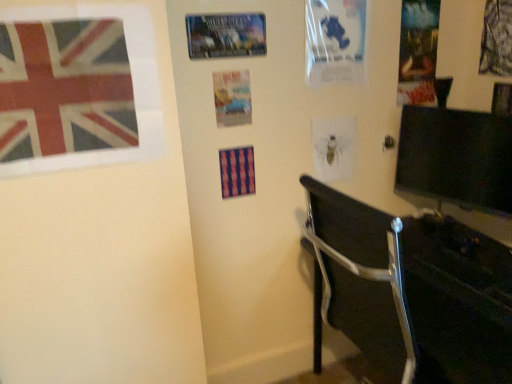
At what (x,y) coordinates should I click in order to perform the action: click on matte paper poster at upper right, marked as the second poster page in a right-to-left arrangement. Please return your answer as a coordinate pair (x, y). The width and height of the screenshot is (512, 384). Looking at the image, I should click on [x=418, y=52].

Describe the element at coordinates (65, 89) in the screenshot. I see `printed fabric flag at upper left` at that location.

Locate an element on the screen. The height and width of the screenshot is (384, 512). metallic silver chair at lower right is located at coordinates (413, 291).

This screenshot has width=512, height=384. Describe the element at coordinates (335, 41) in the screenshot. I see `transparent plastic poster at upper center, arranged as the third poster page when viewed from the left` at that location.

The height and width of the screenshot is (384, 512). What are the coordinates of `metallic silver poster at upper center, which appears as the sixth poster page when viewed from the right` in the screenshot? It's located at (226, 35).

Considering the relative sizes of matte plastic poster at center, placed as the 5th poster page when sorted from right to left, and metallic silver poster at upper center, marked as the first poster page in a left-to-right arrangement, in the image provided, is matte plastic poster at center, placed as the 5th poster page when sorted from right to left, taller than metallic silver poster at upper center, marked as the first poster page in a left-to-right arrangement,?

Indeed, matte plastic poster at center, placed as the 5th poster page when sorted from right to left, has a greater height compared to metallic silver poster at upper center, marked as the first poster page in a left-to-right arrangement.

In the scene shown: Is matte plastic poster at center, placed as the 5th poster page when sorted from right to left, positioned with its back to metallic silver poster at upper center, which appears as the sixth poster page when viewed from the right?

That's not correct — matte plastic poster at center, placed as the 5th poster page when sorted from right to left, is not looking away from metallic silver poster at upper center, which appears as the sixth poster page when viewed from the right.

Can metallic silver poster at upper center, marked as the first poster page in a left-to-right arrangement, be found inside matte plastic poster at center, placed as the 5th poster page when sorted from right to left?

No.

Considering the positions of point (228, 106) and point (208, 55), is point (228, 106) closer or farther from the camera than point (208, 55)?

Point (228, 106) is positioned farther from the camera compared to point (208, 55).

Does point (232, 28) come farther from viewer compared to point (241, 170)?

No, (232, 28) is in front of (241, 170).

Is metallic silver poster at upper center, which appears as the sixth poster page when viewed from the right, placed right next to pink fabric poster at center?

There is a gap between metallic silver poster at upper center, which appears as the sixth poster page when viewed from the right, and pink fabric poster at center.

Can you confirm if metallic silver poster at upper center, marked as the first poster page in a left-to-right arrangement, is wider than pink fabric poster at center?

No, metallic silver poster at upper center, marked as the first poster page in a left-to-right arrangement, is not wider than pink fabric poster at center.

Between matte paper poster at upper right, marked as the second poster page in a right-to-left arrangement, and black glossy monitor at right, which one has larger size?

black glossy monitor at right is bigger.

Considering the positions of objects matte paper poster at upper right, the fifth poster page when ordered from left to right, and black glossy monitor at right in the image provided, who is more to the left, matte paper poster at upper right, the fifth poster page when ordered from left to right, or black glossy monitor at right?

From the viewer's perspective, matte paper poster at upper right, the fifth poster page when ordered from left to right, appears more on the left side.

The width and height of the screenshot is (512, 384). Identify the location of computer monitor in front of the matte paper poster at upper right, the fifth poster page when ordered from left to right. (456, 158).

Would you say matte paper poster at upper right, the fifth poster page when ordered from left to right, is inside or outside black glossy monitor at right?

matte paper poster at upper right, the fifth poster page when ordered from left to right, is spatially situated outside black glossy monitor at right.

From the picture: Could you tell me if textured fabric poster at upper right, arranged as the sixth poster page when viewed from the left, is turned towards matte paper poster at upper right, the fifth poster page when ordered from left to right?

Yes, textured fabric poster at upper right, arranged as the sixth poster page when viewed from the left, is facing matte paper poster at upper right, the fifth poster page when ordered from left to right.

From a real-world perspective, which is physically above, textured fabric poster at upper right, arranged as the sixth poster page when viewed from the left, or matte paper poster at upper right, the fifth poster page when ordered from left to right?

textured fabric poster at upper right, arranged as the sixth poster page when viewed from the left.

Considering the relative sizes of textured fabric poster at upper right, arranged as the first poster page when viewed from the right, and matte paper poster at upper right, marked as the second poster page in a right-to-left arrangement, in the image provided, is textured fabric poster at upper right, arranged as the first poster page when viewed from the right, shorter than matte paper poster at upper right, marked as the second poster page in a right-to-left arrangement,?

Indeed, textured fabric poster at upper right, arranged as the first poster page when viewed from the right, has a lesser height compared to matte paper poster at upper right, marked as the second poster page in a right-to-left arrangement.

You are a GUI agent. You are given a task and a screenshot of the screen. Output one action in this format:
    pyautogui.click(x=<x>, y=<y>)
    Task: Click on the 5th poster page located beneath the metallic silver poster at upper center, marked as the first poster page in a left-to-right arrangement (from a real-world perspective)
    This screenshot has height=384, width=512.
    Given the screenshot: What is the action you would take?
    pyautogui.click(x=333, y=148)

Based on the photo, from the image's perspective, which one is positioned lower, metallic silver poster at upper center, which appears as the sixth poster page when viewed from the right, or translucent paper poster at center, which is the 4th poster page in left-to-right order?

translucent paper poster at center, which is the 4th poster page in left-to-right order, is shown below in the image.

Does metallic silver poster at upper center, marked as the first poster page in a left-to-right arrangement, appear on the right side of translucent paper poster at center, the 3th poster page positioned from the right?

In fact, metallic silver poster at upper center, marked as the first poster page in a left-to-right arrangement, is to the left of translucent paper poster at center, the 3th poster page positioned from the right.

From the image's perspective, does matte plastic poster at center, which is the second poster page in left-to-right order, appear higher than textured fabric poster at upper right, arranged as the sixth poster page when viewed from the left?

No.

Between matte plastic poster at center, which is the second poster page in left-to-right order, and textured fabric poster at upper right, arranged as the sixth poster page when viewed from the left, which one has smaller width?

matte plastic poster at center, which is the second poster page in left-to-right order.

Is matte plastic poster at center, placed as the 5th poster page when sorted from right to left, facing away from textured fabric poster at upper right, arranged as the sixth poster page when viewed from the left?

No, textured fabric poster at upper right, arranged as the sixth poster page when viewed from the left, is not at the back of matte plastic poster at center, placed as the 5th poster page when sorted from right to left.

How many degrees apart are the facing directions of matte plastic poster at center, placed as the 5th poster page when sorted from right to left, and textured fabric poster at upper right, arranged as the first poster page when viewed from the right?

89.9 degrees.

Is there a large distance between translucent paper poster at center, the 3th poster page positioned from the right, and matte paper poster at upper right, marked as the second poster page in a right-to-left arrangement?

They are positioned close to each other.

Is translucent paper poster at center, which is the 4th poster page in left-to-right order, inside the boundaries of matte paper poster at upper right, marked as the second poster page in a right-to-left arrangement, or outside?

translucent paper poster at center, which is the 4th poster page in left-to-right order, exists outside the volume of matte paper poster at upper right, marked as the second poster page in a right-to-left arrangement.

Is translucent paper poster at center, the 3th poster page positioned from the right, facing away from matte paper poster at upper right, the fifth poster page when ordered from left to right?

No, translucent paper poster at center, the 3th poster page positioned from the right, is not facing the opposite direction of matte paper poster at upper right, the fifth poster page when ordered from left to right.

Considering the sizes of objects translucent paper poster at center, the 3th poster page positioned from the right, and matte paper poster at upper right, the fifth poster page when ordered from left to right, in the image provided, who is thinner, translucent paper poster at center, the 3th poster page positioned from the right, or matte paper poster at upper right, the fifth poster page when ordered from left to right,?

Thinner between the two is matte paper poster at upper right, the fifth poster page when ordered from left to right.

Find the location of `poster page on the left of matte plastic poster at center, placed as the 5th poster page when sorted from right to left`. poster page on the left of matte plastic poster at center, placed as the 5th poster page when sorted from right to left is located at coordinates (226, 35).

Locate an element on the screen. The image size is (512, 384). the 4th poster page in front when counting from the pink fabric poster at center is located at coordinates (226, 35).

Looking at the image, which one is located further to black glossy monitor at right, transparent plastic poster at upper center, arranged as the third poster page when viewed from the left, or metallic silver chair at lower right?

Among the two, transparent plastic poster at upper center, arranged as the third poster page when viewed from the left, is located further to black glossy monitor at right.

When comparing their distances from printed fabric flag at upper left, does metallic silver poster at upper center, which appears as the sixth poster page when viewed from the right, or transparent plastic poster at upper center, placed as the 4th poster page when sorted from right to left, seem further?

transparent plastic poster at upper center, placed as the 4th poster page when sorted from right to left.

Looking at the image, which one is located closer to textured fabric poster at upper right, arranged as the sixth poster page when viewed from the left, pink fabric poster at center or transparent plastic poster at upper center, arranged as the third poster page when viewed from the left?

transparent plastic poster at upper center, arranged as the third poster page when viewed from the left, is positioned closer to the anchor textured fabric poster at upper right, arranged as the sixth poster page when viewed from the left.

Considering their positions, is metallic silver poster at upper center, which appears as the sixth poster page when viewed from the right, positioned closer to metallic silver chair at lower right than pink fabric poster at center?

Based on the image, pink fabric poster at center appears to be nearer to metallic silver chair at lower right.

From the image, which object appears to be farther from matte plastic poster at center, placed as the 5th poster page when sorted from right to left, pink fabric poster at center or textured fabric poster at upper right, arranged as the sixth poster page when viewed from the left?

textured fabric poster at upper right, arranged as the sixth poster page when viewed from the left, is further to matte plastic poster at center, placed as the 5th poster page when sorted from right to left.

Considering their positions, is transparent plastic poster at upper center, arranged as the third poster page when viewed from the left, positioned further to textured fabric poster at upper right, arranged as the sixth poster page when viewed from the left, than metallic silver chair at lower right?

metallic silver chair at lower right is positioned further to the anchor textured fabric poster at upper right, arranged as the sixth poster page when viewed from the left.

Considering their positions, is metallic silver poster at upper center, which appears as the sixth poster page when viewed from the right, positioned closer to matte paper poster at upper right, marked as the second poster page in a right-to-left arrangement, than black glossy monitor at right?

black glossy monitor at right is positioned closer to the anchor matte paper poster at upper right, marked as the second poster page in a right-to-left arrangement.

Considering their positions, is textured fabric poster at upper right, arranged as the first poster page when viewed from the right, positioned further to pink fabric poster at center than transparent plastic poster at upper center, placed as the 4th poster page when sorted from right to left?

The object further to pink fabric poster at center is textured fabric poster at upper right, arranged as the first poster page when viewed from the right.

You are a GUI agent. You are given a task and a screenshot of the screen. Output one action in this format:
    pyautogui.click(x=<x>, y=<y>)
    Task: Click on the computer monitor between matte paper poster at upper right, the fifth poster page when ordered from left to right, and metallic silver chair at lower right from top to bottom
    The width and height of the screenshot is (512, 384).
    Given the screenshot: What is the action you would take?
    pyautogui.click(x=456, y=158)

This screenshot has width=512, height=384. I want to click on furniture located between printed fabric flag at upper left and textured fabric poster at upper right, arranged as the first poster page when viewed from the right, in the left-right direction, so click(x=413, y=291).

Find the location of a particular element. computer monitor between transparent plastic poster at upper center, placed as the 4th poster page when sorted from right to left, and textured fabric poster at upper right, arranged as the sixth poster page when viewed from the left is located at coordinates (456, 158).

Where is `computer monitor situated between printed fabric flag at upper left and textured fabric poster at upper right, arranged as the sixth poster page when viewed from the left, from left to right`? This screenshot has height=384, width=512. computer monitor situated between printed fabric flag at upper left and textured fabric poster at upper right, arranged as the sixth poster page when viewed from the left, from left to right is located at coordinates (456, 158).